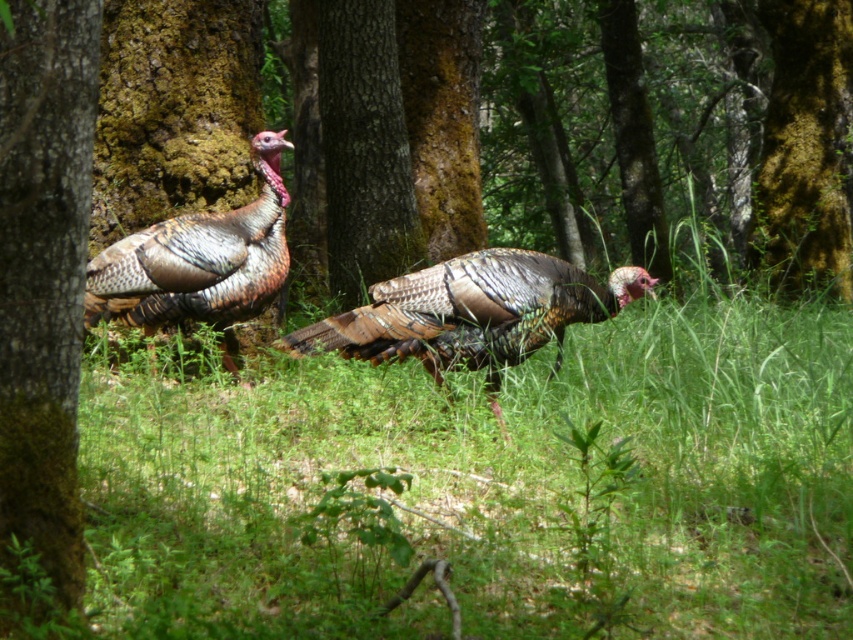
Does point (45, 305) lie behind point (833, 264)?

No, it is in front of (833, 264).

What do you see at coordinates (44, 276) in the screenshot?
I see `brown textured bark at left` at bounding box center [44, 276].

At what (x,y) coordinates should I click in order to perform the action: click on brown textured bark at left. Please return your answer as a coordinate pair (x, y). The image size is (853, 640). Looking at the image, I should click on (44, 276).

In the scene shown: Is multicolored feathered turkey at center wider than green mossy bark at center?

Yes, multicolored feathered turkey at center is wider than green mossy bark at center.

At what (x,y) coordinates should I click in order to perform the action: click on multicolored feathered turkey at center. Please return your answer as a coordinate pair (x, y). This screenshot has height=640, width=853. Looking at the image, I should click on (473, 312).

The height and width of the screenshot is (640, 853). What do you see at coordinates (44, 276) in the screenshot?
I see `brown textured bark at left` at bounding box center [44, 276].

Between point (45, 538) and point (184, 250), which one is positioned in front?

Point (45, 538) is in front.

Where is `brown textured bark at left`? This screenshot has width=853, height=640. brown textured bark at left is located at coordinates (44, 276).